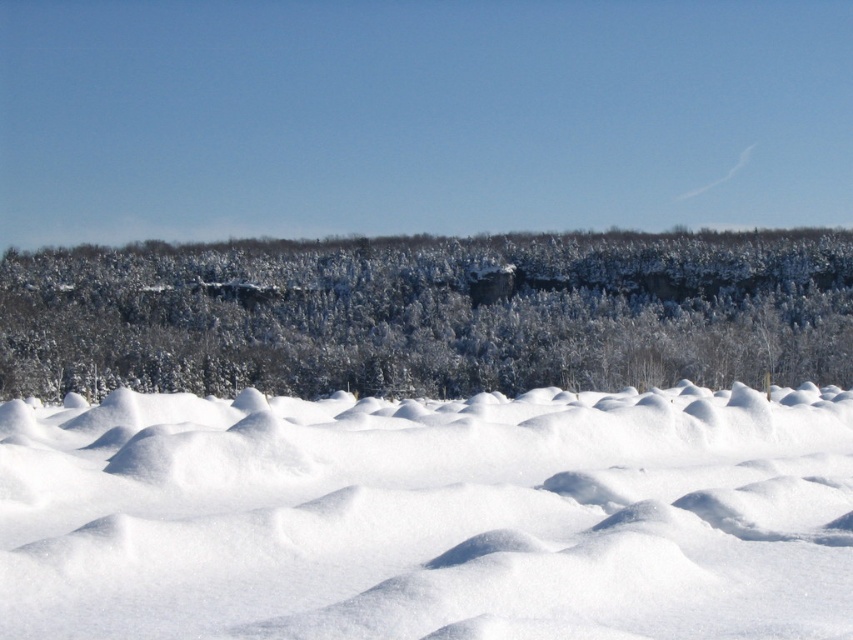
Is white fluffy snow at center below white snow-covered trees at center?

Correct, white fluffy snow at center is located below white snow-covered trees at center.

Between point (834, 497) and point (462, 248), which one is positioned behind?

Point (462, 248)

Is point (90, 541) more distant than point (210, 248)?

No, (90, 541) is closer to viewer.

At what (x,y) coordinates should I click in order to perform the action: click on white fluffy snow at center. Please return your answer as a coordinate pair (x, y). This screenshot has height=640, width=853. Looking at the image, I should click on (428, 516).